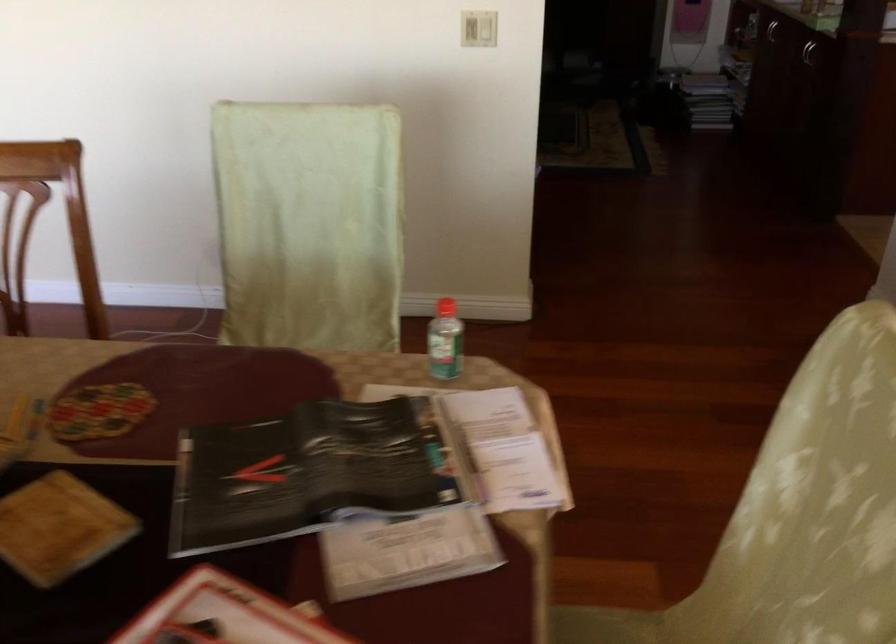
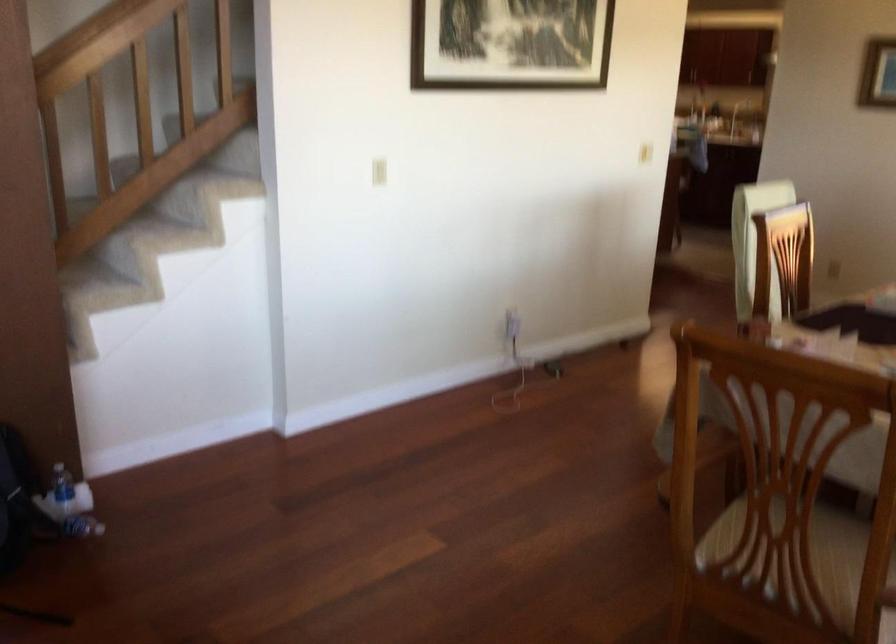
In the second image, find the point that corresponds to [207,234] in the first image.

(512, 324)